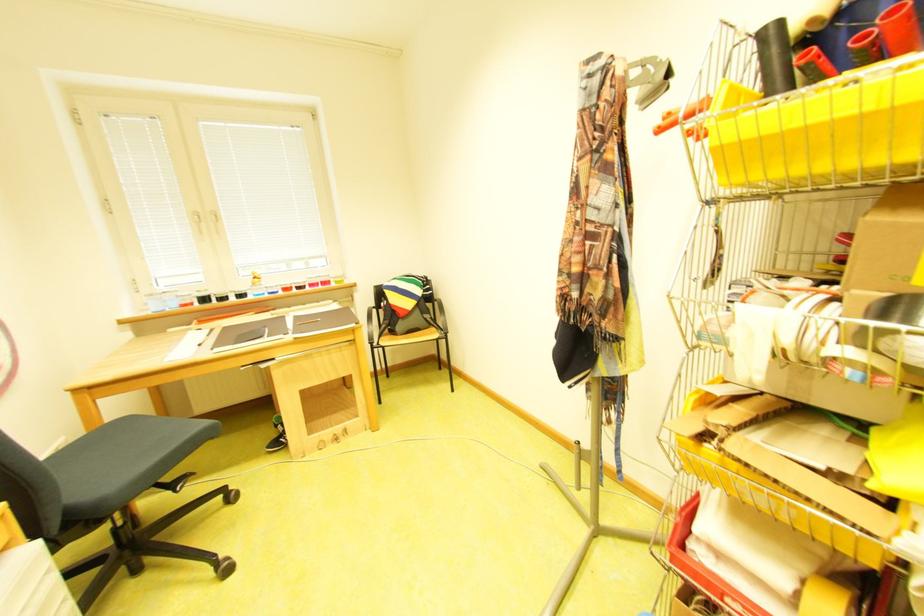
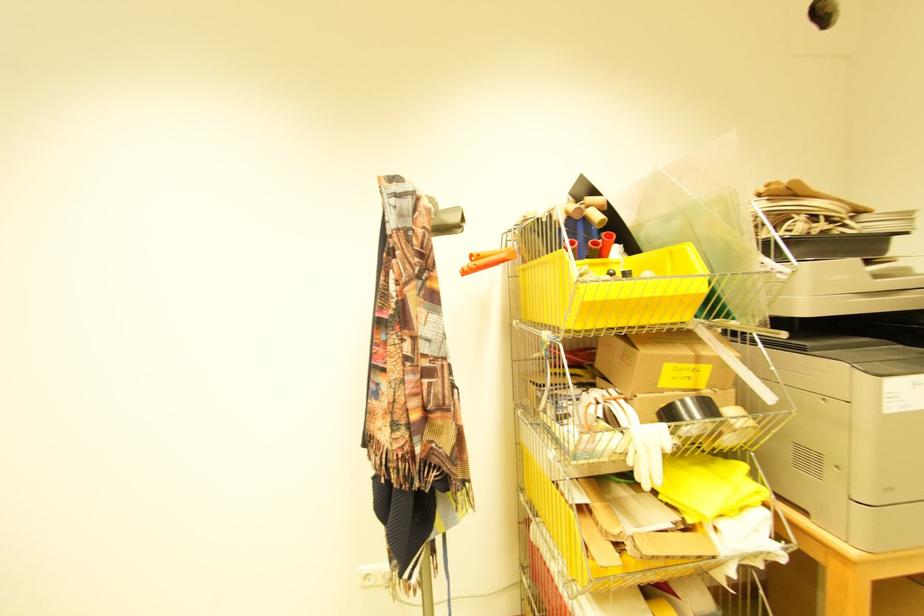
Find the pixel in the second image that matches the point at 687,111 in the first image.

(492, 254)